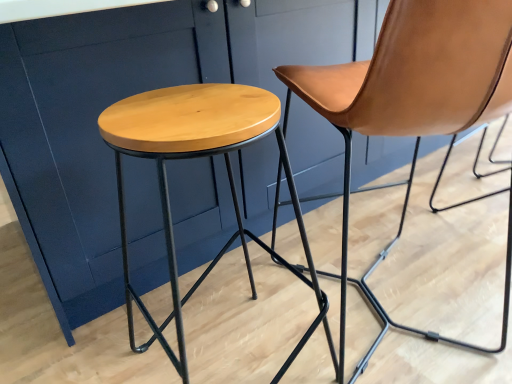
Question: Which is correct: brown leather chair at center is inside natural wood stool at center, or outside of it?

Choices:
 (A) inside
 (B) outside

Answer: (B)

Question: Is brown leather chair at center in front of or behind natural wood stool at center in the image?

Choices:
 (A) front
 (B) behind

Answer: (B)

Question: Considering the positions of brown leather chair at center and natural wood stool at center in the image, is brown leather chair at center wider or thinner than natural wood stool at center?

Choices:
 (A) thin
 (B) wide

Answer: (B)

Question: Does point (214, 97) appear closer or farther from the camera than point (303, 97)?

Choices:
 (A) closer
 (B) farther

Answer: (A)

Question: Considering the positions of natural wood stool at center and brown leather chair at center in the image, is natural wood stool at center bigger or smaller than brown leather chair at center?

Choices:
 (A) small
 (B) big

Answer: (A)

Question: In terms of width, does natural wood stool at center look wider or thinner when compared to brown leather chair at center?

Choices:
 (A) wide
 (B) thin

Answer: (B)

Question: Would you say natural wood stool at center is to the left or to the right of brown leather chair at center in the picture?

Choices:
 (A) left
 (B) right

Answer: (A)